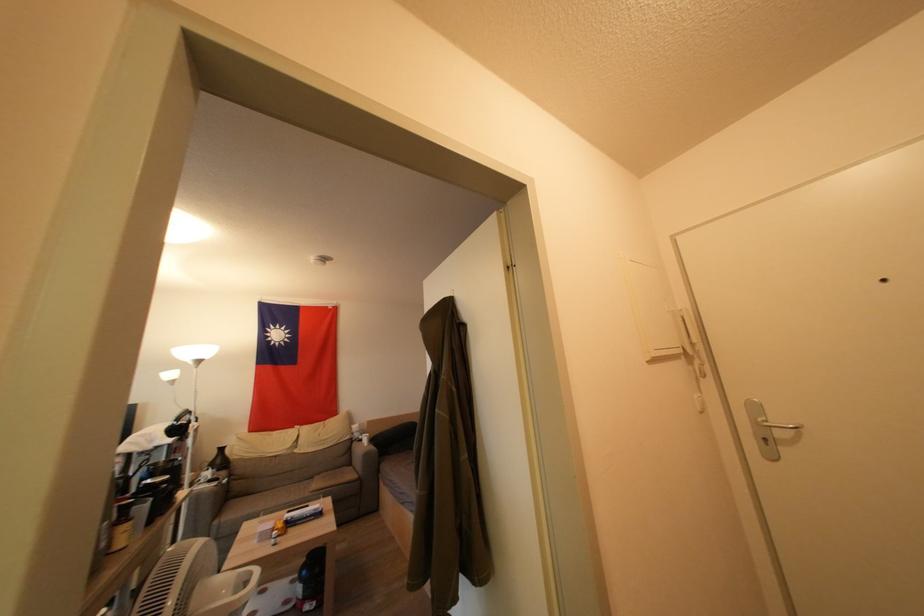
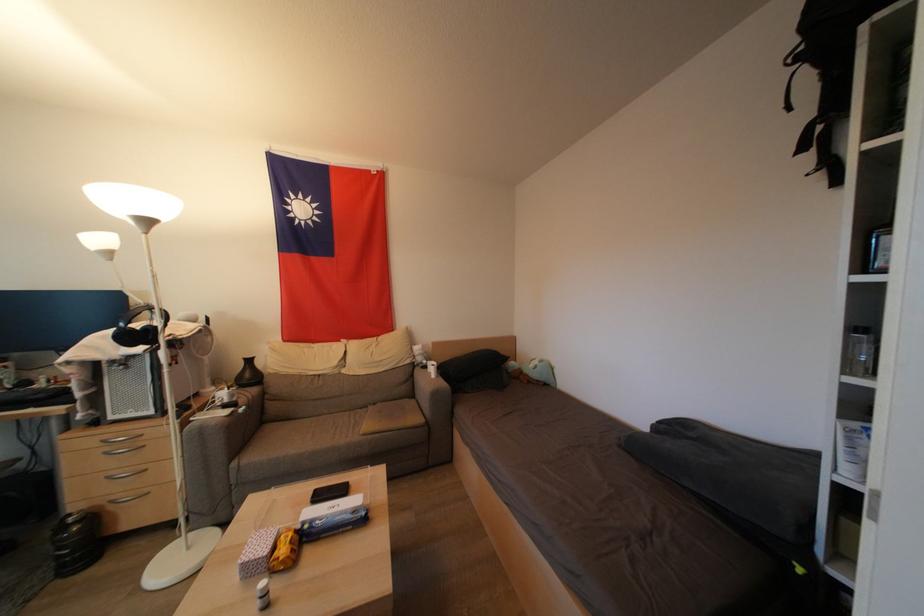
In the second image, find the point that corresponds to pixel 321 482 in the first image.

(375, 411)